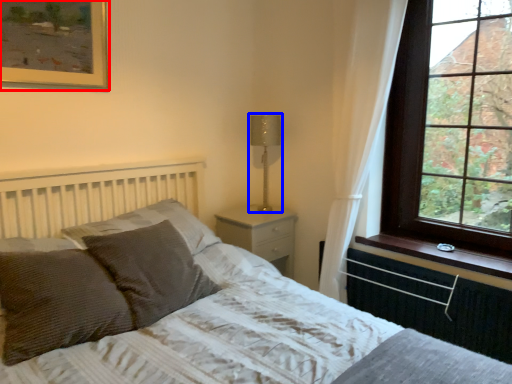
Question: Which of the following is the closest to the observer, picture frame (highlighted by a red box) or table lamp (highlighted by a blue box)?

Choices:
 (A) picture frame
 (B) table lamp

Answer: (A)